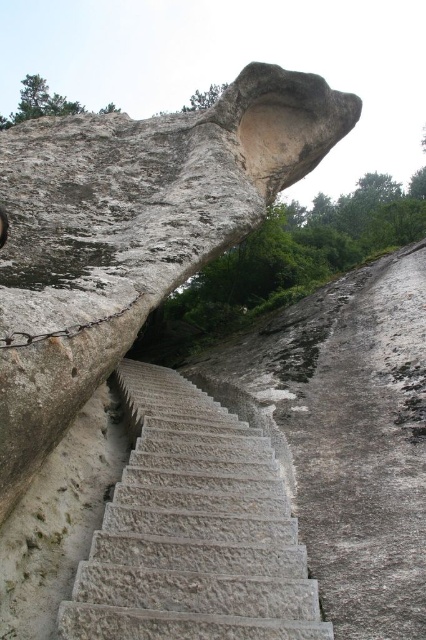
You are a hiker standing at the base of the stone staircase carved into the cliff. You need to place a small marker exactly at the midpoint between the smooth gray rock at center and the top of the stone staircase. What are the coordinates of this midpoint?

The midpoint between the smooth gray rock at center and the top of the stone staircase would be calculated by averaging their coordinates. Since the smooth gray rock at center is at point (131, 232), and the top of the stone staircase is at the highest point of the cliff, which is assumed to be at coordinates (425, 320), the midpoint coordinates are (278, 276).

You are a hiker trying to navigate the stone staircase. You notice a smooth gray rock at center and gray stone stairs at center. Which one is wider?

The smooth gray rock at center is wider than the gray stone stairs at center.

You are a hiker trying to reach the top of the cliff. You see the smooth gray rock at center and the gray stone stairs at center. Which one should you climb first?

The smooth gray rock at center is located above the gray stone stairs at center, so you should climb the gray stone stairs at center first before reaching the smooth gray rock at center.